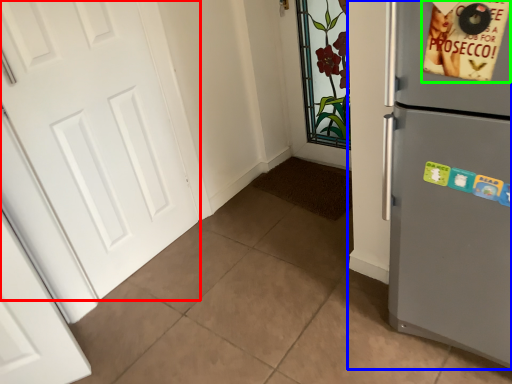
Question: Which is nearer to the door (highlighted by a red box)? refrigerator (highlighted by a blue box) or postcard (highlighted by a green box).

Choices:
 (A) refrigerator
 (B) postcard

Answer: (A)